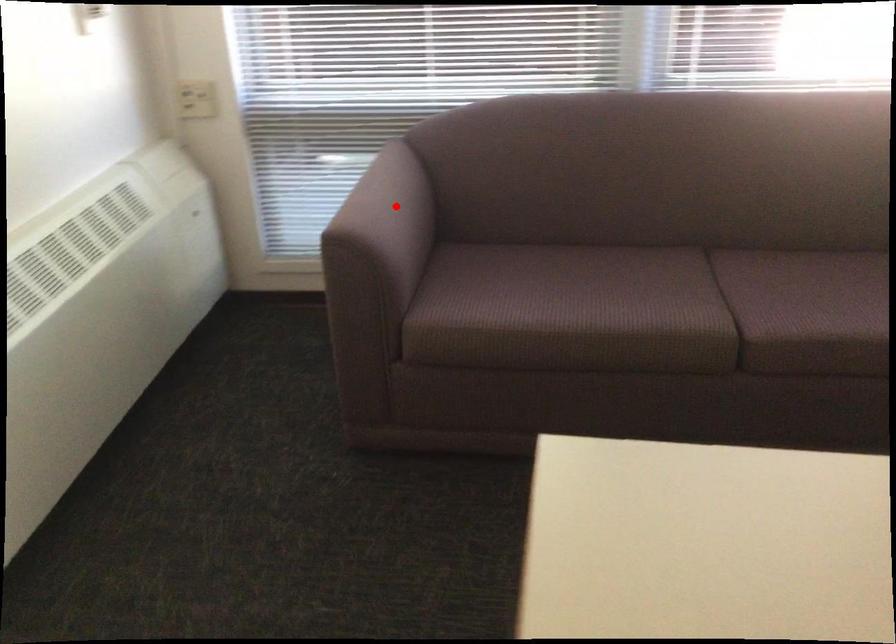
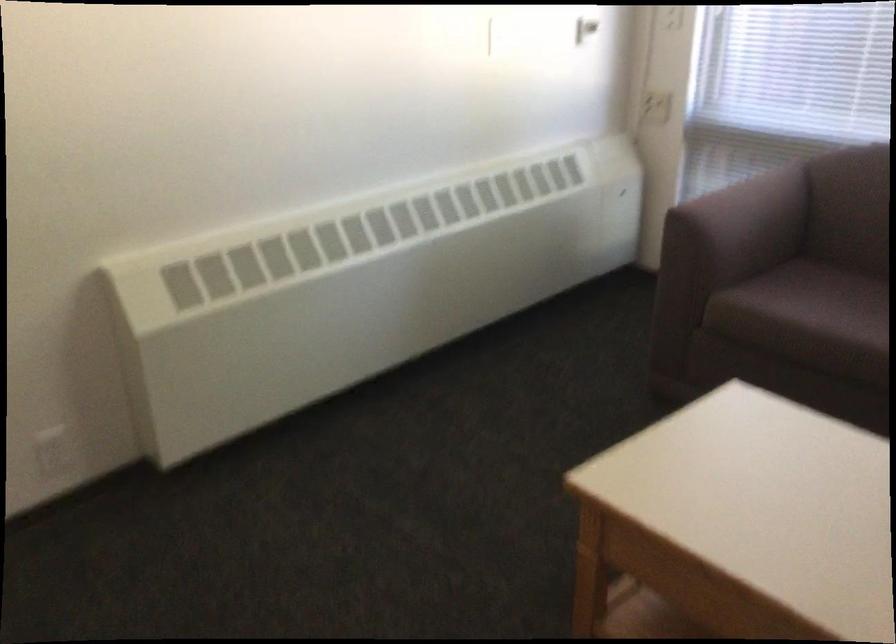
Question: I am providing you with two images of the same scene from different viewpoints. Given a red point in image1, look at the same physical point in image2. Is it:

Choices:
 (A) Closer to the viewpoint
 (B) Farther from the viewpoint

Answer: (B)